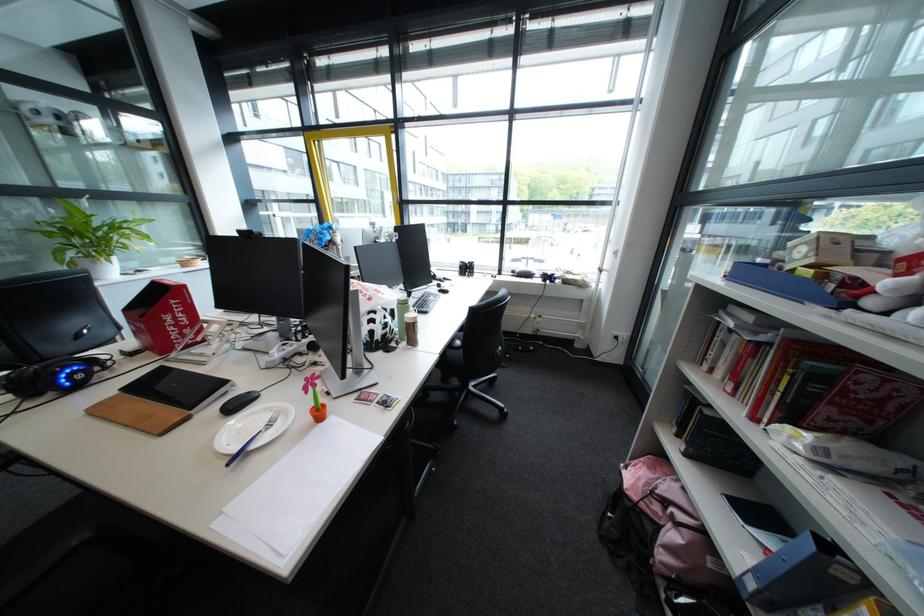
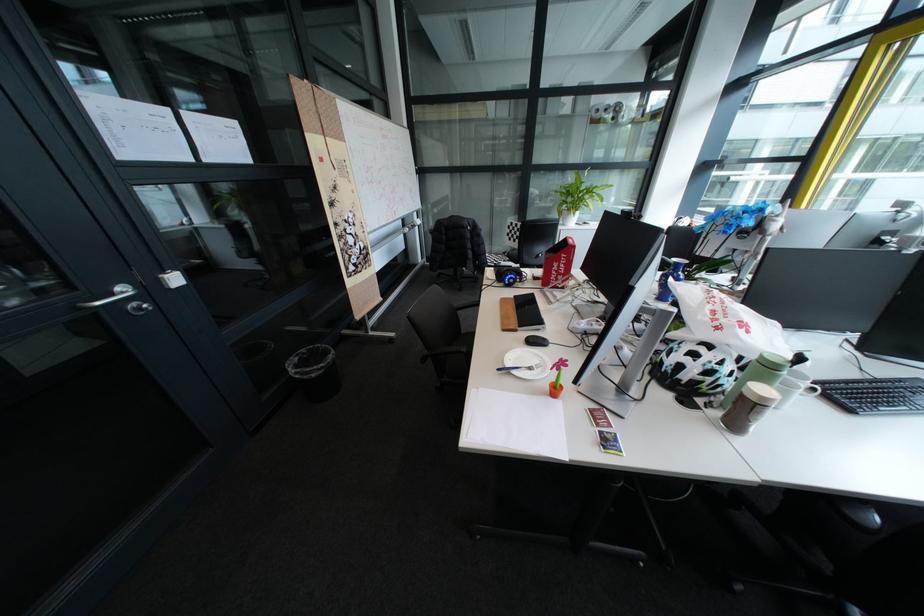
Locate, in the second image, the point that corresponds to the point at 69,259 in the first image.

(572, 209)